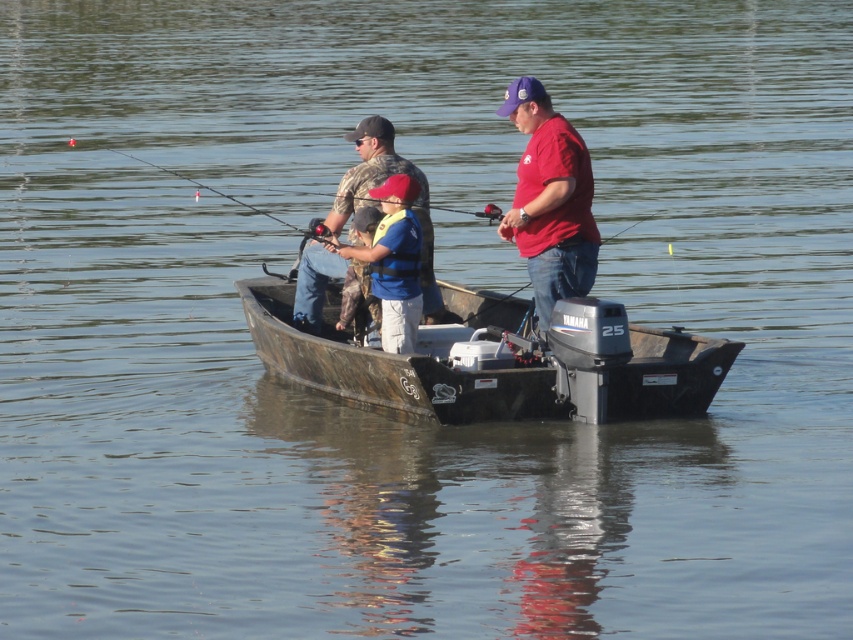
Question: Which of these objects is positioned closest to the blue life vest at center?

Choices:
 (A) camouflage fabric jacket at center
 (B) camouflage fabric boat at center
 (C) matte red shirt at center

Answer: (A)

Question: Does camouflage fabric boat at center appear over camouflage fabric jacket at center?

Choices:
 (A) no
 (B) yes

Answer: (A)

Question: Can you confirm if camouflage fabric boat at center is wider than matte red shirt at center?

Choices:
 (A) yes
 (B) no

Answer: (A)

Question: Which object is farther from the camera taking this photo?

Choices:
 (A) matte red shirt at center
 (B) blue life vest at center

Answer: (A)

Question: From the image, what is the correct spatial relationship of camouflage fabric boat at center in relation to matte red shirt at center?

Choices:
 (A) below
 (B) above

Answer: (A)

Question: Among these objects, which one is nearest to the camera?

Choices:
 (A) blue life vest at center
 (B) camouflage fabric boat at center

Answer: (B)